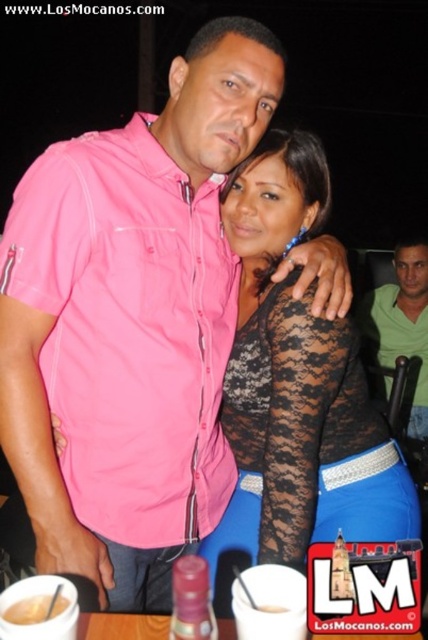
You are a photographer setting up for a group photo. You have a marker at point coordinates (403, 323). Which object in the scene is this point located on?

The point at coordinates (403, 323) is located on the green matte shirt at right.

Based on the photo, you are standing in the same room as the people in the image. You need to locate the green matte shirt at right. Where would you look relative to the other people in the scene?

The green matte shirt at right is located at point 0.506 on the x axis and 0.942 on the y axis, so you should look towards the lower right area of the scene.

You are a photographer trying to decide where to place a new decorative item in the scene. The item is 3 inches thick. You have two options to place it either on the pink cotton shirt at center or on the white glossy mug at lower center. Based on their thickness, which object can support the item without it slipping off?

The white glossy mug at lower center is thicker than the pink cotton shirt at center. Since the decorative item is 3 inches thick, it would require a sturdier base. The white glossy mug at lower center, being thicker, can provide better support and prevent the item from slipping off.